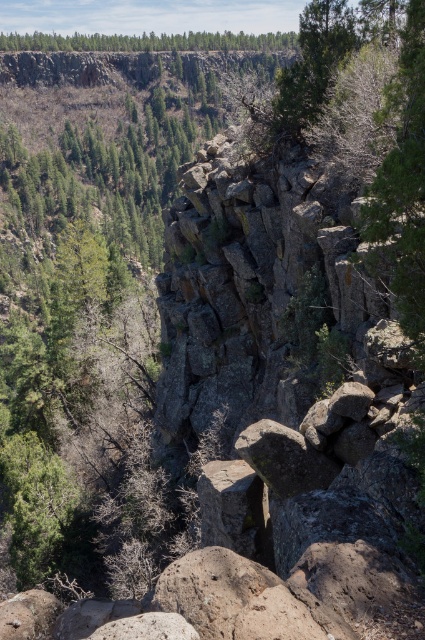
Does green textured tree at upper right lie behind green matte forest at upper center?

No, green textured tree at upper right is in front of green matte forest at upper center.

Which is more to the right, green textured tree at upper right or green matte forest at upper center?

green textured tree at upper right is more to the right.

Which is behind, point (350, 29) or point (51, 44)?

Point (51, 44)

Identify the location of green textured tree at upper right. This screenshot has height=640, width=425. (312, 64).